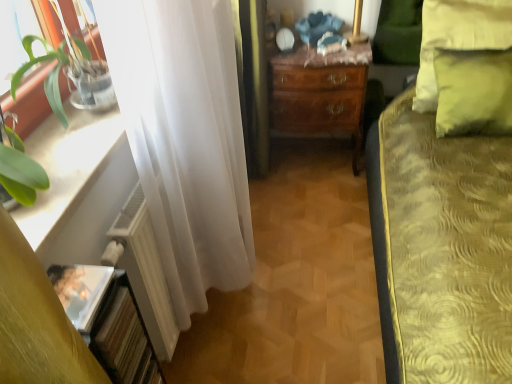
Where is `green leafy plant at left`? Image resolution: width=512 pixels, height=384 pixels. green leafy plant at left is located at coordinates (64, 66).

The image size is (512, 384). What do you see at coordinates (64, 66) in the screenshot?
I see `green leafy plant at left` at bounding box center [64, 66].

Consider the image. What is the approximate width of white matte radiator at left?

white matte radiator at left is 3.00 inches in width.

Based on the photo, in order to face yellow fabric pillow at upper right, should I rotate leftwards or rightwards?

You should rotate right by 24.774 degrees.

I want to click on white sheer curtain at left, so click(x=180, y=155).

What do you see at coordinates (65, 164) in the screenshot? The height and width of the screenshot is (384, 512). I see `white glossy window sill at left` at bounding box center [65, 164].

The image size is (512, 384). What are the coordinates of `green leafy plant at left` in the screenshot? It's located at click(64, 66).

Which object is further away from the camera, white glossy window sill at left or green leafy plant at left?

white glossy window sill at left is behind.

From the image's perspective, which object appears higher, white glossy window sill at left or green leafy plant at left?

green leafy plant at left, from the image's perspective.

Which is less distant, (55, 120) or (9, 163)?

Point (55, 120).

Is white glossy window sill at left surrounding green leafy plant at left?

No.

Considering the sizes of objects mahogany wooden desk at center and white matte radiator at left in the image provided, who is smaller, mahogany wooden desk at center or white matte radiator at left?

white matte radiator at left.

Considering the relative sizes of mahogany wooden desk at center and white matte radiator at left in the image provided, is mahogany wooden desk at center thinner than white matte radiator at left?

In fact, mahogany wooden desk at center might be wider than white matte radiator at left.

From the picture: Is mahogany wooden desk at center looking in the opposite direction of white matte radiator at left?

That's not correct — mahogany wooden desk at center is not looking away from white matte radiator at left.

Considering the positions of point (304, 114) and point (163, 319), is point (304, 114) closer or farther from the camera than point (163, 319)?

Clearly, point (304, 114) is more distant from the camera than point (163, 319).

From the image's perspective, which one is positioned lower, white matte radiator at left or white sheer curtain at left?

white matte radiator at left.

Based on their positions, is white matte radiator at left located to the left or right of white sheer curtain at left?

From the image, it's evident that white matte radiator at left is to the left of white sheer curtain at left.

Considering the sizes of objects white matte radiator at left and white sheer curtain at left in the image provided, who is smaller, white matte radiator at left or white sheer curtain at left?

white matte radiator at left is smaller.

The width and height of the screenshot is (512, 384). I want to click on window sill in front of the mahogany wooden desk at center, so click(65, 164).

Could you tell me if mahogany wooden desk at center is facing white glossy window sill at left?

No, mahogany wooden desk at center does not turn towards white glossy window sill at left.

From the image's perspective, is white glossy window sill at left positioned above or below white sheer curtain at left?

Clearly, from the image's perspective, white glossy window sill at left is below white sheer curtain at left.

Can you see white glossy window sill at left touching white sheer curtain at left?

No, white glossy window sill at left is not next to white sheer curtain at left.

Can you confirm if white matte radiator at left is bigger than yellow fabric pillow at upper right?

No.

Considering the sizes of objects white matte radiator at left and yellow fabric pillow at upper right in the image provided, who is thinner, white matte radiator at left or yellow fabric pillow at upper right?

white matte radiator at left.

From the image's perspective, is white matte radiator at left positioned above or below yellow fabric pillow at upper right?

white matte radiator at left is situated lower than yellow fabric pillow at upper right in the image.

Looking at this image, from a real-world perspective, does white sheer curtain at left sit lower than green leafy plant at left?

Indeed, from a real-world perspective, white sheer curtain at left is positioned beneath green leafy plant at left.

Find the location of a particular element. This screenshot has width=512, height=384. curtain behind the green leafy plant at left is located at coordinates (180, 155).

Which object is wider, white sheer curtain at left or green leafy plant at left?

white sheer curtain at left is wider.

Find the location of a particular element. The height and width of the screenshot is (384, 512). window sill that is behind the green leafy plant at left is located at coordinates (65, 164).

What are the coordinates of `radiator above the mahogany wooden desk at center (from a real-world perspective)` in the screenshot? It's located at (146, 272).

Looking at the image, which one is located closer to white matte radiator at left, mahogany wooden desk at center or white glossy window sill at left?

white glossy window sill at left lies closer to white matte radiator at left than the other object.

Based on their spatial positions, is green leafy plant at left or white sheer curtain at left closer to white glossy window sill at left?

green leafy plant at left is positioned closer to the anchor white glossy window sill at left.

When comparing their distances from white matte radiator at left, does white sheer curtain at left or yellow fabric pillow at upper right seem closer?

white sheer curtain at left is positioned closer to the anchor white matte radiator at left.

Estimate the real-world distances between objects in this image. Which object is closer to white matte radiator at left, white sheer curtain at left or mahogany wooden desk at center?

The object closer to white matte radiator at left is white sheer curtain at left.

Looking at the image, which one is located closer to white matte radiator at left, mahogany wooden desk at center or white sheer curtain at left?

The object closer to white matte radiator at left is white sheer curtain at left.

Consider the image. When comparing their distances from mahogany wooden desk at center, does white glossy window sill at left or white sheer curtain at left seem further?

Based on the image, white glossy window sill at left appears to be further to mahogany wooden desk at center.

Which object lies nearer to the anchor point mahogany wooden desk at center, white sheer curtain at left or green leafy plant at left?

white sheer curtain at left.

Considering their positions, is white matte radiator at left positioned further to yellow fabric pillow at upper right than mahogany wooden desk at center?

Based on the image, white matte radiator at left appears to be further to yellow fabric pillow at upper right.

Locate an element on the screen. The height and width of the screenshot is (384, 512). radiator situated between white glossy window sill at left and yellow fabric pillow at upper right from left to right is located at coordinates (146, 272).

You are a GUI agent. You are given a task and a screenshot of the screen. Output one action in this format:
    pyautogui.click(x=<x>, y=<y>)
    Task: Click on the window sill between green leafy plant at left and white matte radiator at left in the front-back direction
    
    Given the screenshot: What is the action you would take?
    coord(65,164)

Identify the location of curtain between green leafy plant at left and white matte radiator at left vertically. The width and height of the screenshot is (512, 384). (180, 155).

The image size is (512, 384). I want to click on desk between white matte radiator at left and yellow fabric pillow at upper right in the horizontal direction, so click(x=320, y=92).